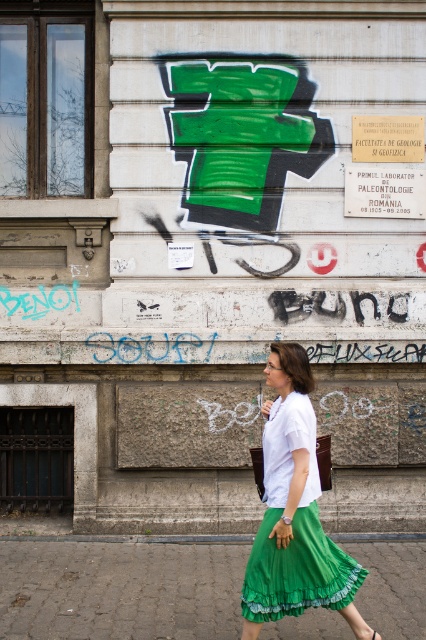
Question: Does gray cobblestone pavement at lower center appear on the right side of green fabric sandal at lower center?

Choices:
 (A) yes
 (B) no

Answer: (B)

Question: Which is nearer to the green satin skirt at center?

Choices:
 (A) green fabric sandal at lower center
 (B) gray cobblestone pavement at lower center

Answer: (A)

Question: Does gray cobblestone pavement at lower center appear under green satin skirt at center?

Choices:
 (A) yes
 (B) no

Answer: (A)

Question: Which of the following is the farthest from the observer?

Choices:
 (A) gray cobblestone pavement at lower center
 (B) green fabric sandal at lower center
 (C) green satin skirt at center

Answer: (A)

Question: Is gray cobblestone pavement at lower center to the right of green satin skirt at center from the viewer's perspective?

Choices:
 (A) yes
 (B) no

Answer: (B)

Question: Which point is closer to the camera taking this photo?

Choices:
 (A) (37, 634)
 (B) (368, 627)

Answer: (B)